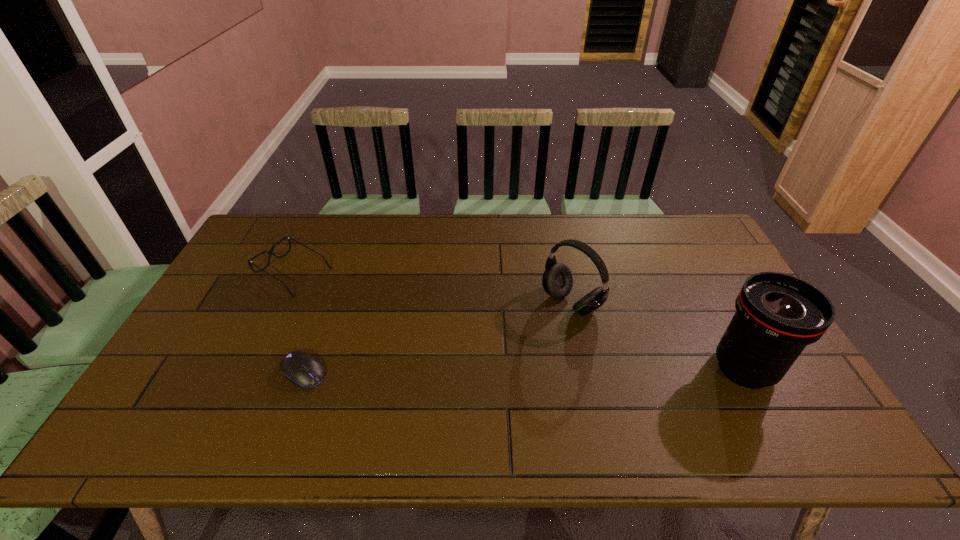
The height and width of the screenshot is (540, 960). I want to click on vacant area that lies between the rightmost object and the computer mouse, so pyautogui.click(x=524, y=370).

The image size is (960, 540). What are the coordinates of `empty space that is in between the spectacles and the second object from right to left` in the screenshot? It's located at (433, 288).

The width and height of the screenshot is (960, 540). Find the location of `vacant area that lies between the third tallest object and the shortest object`. vacant area that lies between the third tallest object and the shortest object is located at coordinates (299, 322).

At what (x,y) coordinates should I click in order to perform the action: click on vacant region between the rightmost object and the second tallest object. Please return your answer as a coordinate pair (x, y). The width and height of the screenshot is (960, 540). Looking at the image, I should click on (658, 336).

The width and height of the screenshot is (960, 540). What are the coordinates of `free point between the rightmost object and the third shortest object` in the screenshot? It's located at (658, 336).

Find the location of `vacant point located between the computer mouse and the third object from left to right`. vacant point located between the computer mouse and the third object from left to right is located at coordinates (438, 338).

Find the location of a particular element. The image size is (960, 540). object that is the second closest to the spectacles is located at coordinates 557,280.

Identify the location of object that can be found as the second closest to the shortest object. (557, 280).

The image size is (960, 540). Find the location of `vacant region that satisfies the following two spatial constraints: 1. on the back side of the computer mouse; 2. on the right side of the telephoto lens`. vacant region that satisfies the following two spatial constraints: 1. on the back side of the computer mouse; 2. on the right side of the telephoto lens is located at coordinates (305, 369).

Find the location of a particular element. The width and height of the screenshot is (960, 540). free space that satisfies the following two spatial constraints: 1. on the back side of the third object from left to right; 2. on the left side of the shortest object is located at coordinates (328, 303).